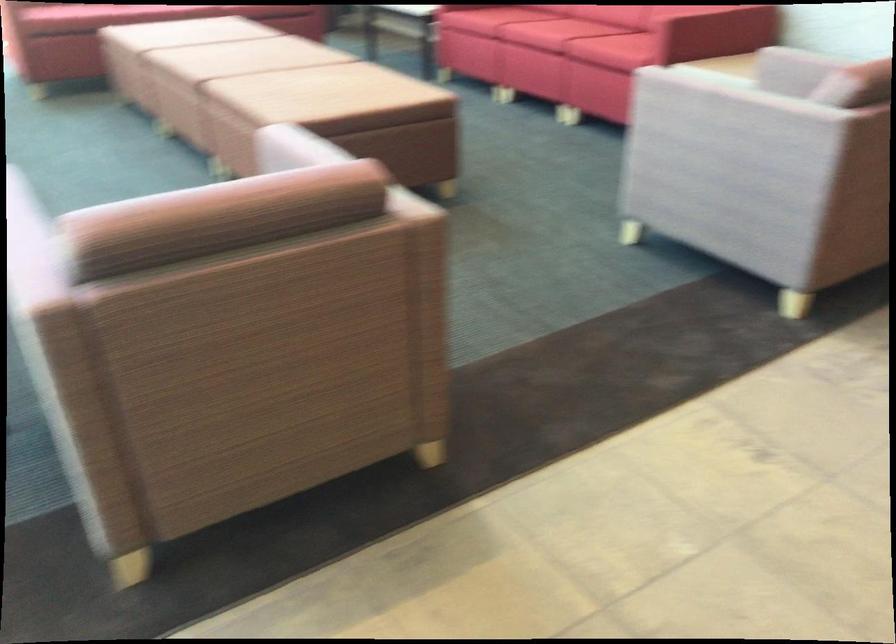
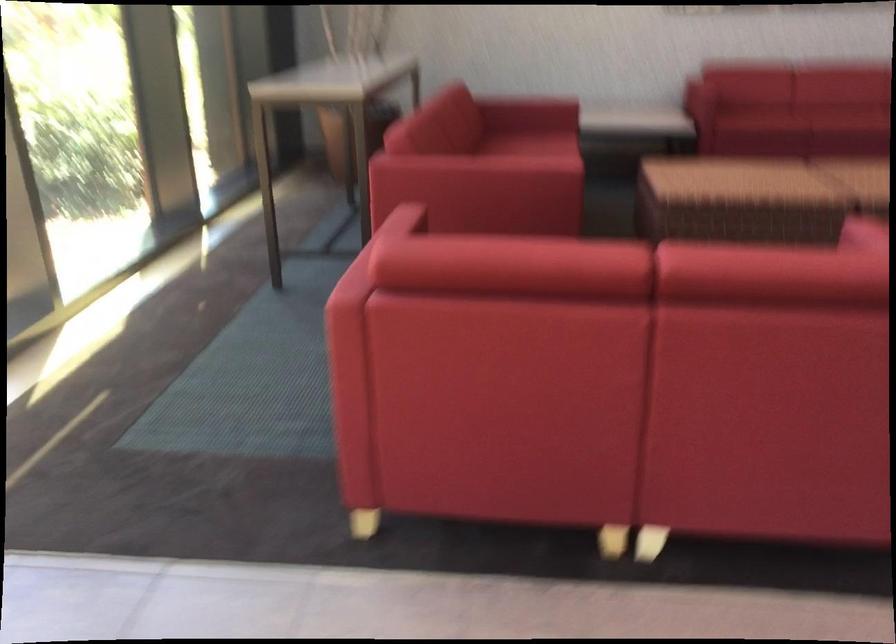
Question: Which direction would the cameraman need to move to produce the second image? Reply with the corresponding letter.

Choices:
 (A) Left
 (B) Right
 (C) Forward
 (D) Backward

Answer: (D)